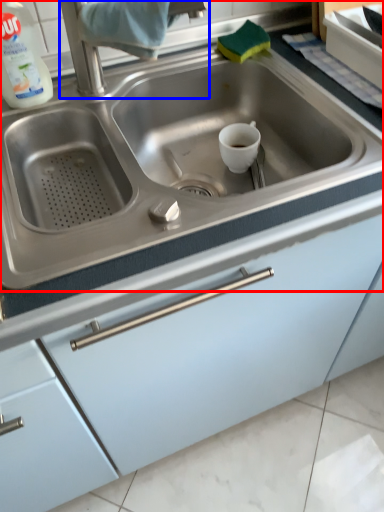
Question: Among these objects, which one is farthest to the camera, sink (highlighted by a red box) or faucet (highlighted by a blue box)?

Choices:
 (A) sink
 (B) faucet

Answer: (B)